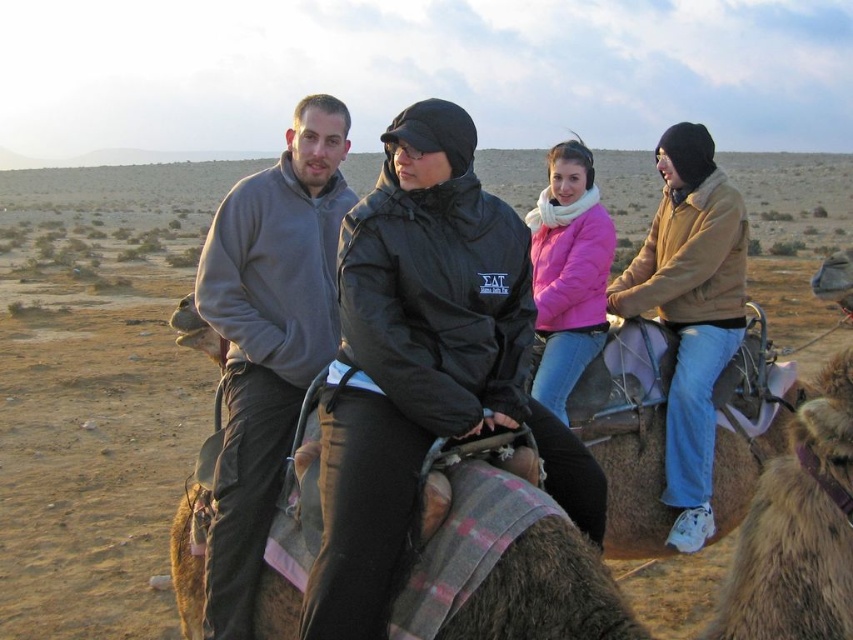
You are a photographer trying to capture a clear photo of the black matte jacket at center and the pink matte jacket at center. Which jacket should you focus on first to ensure it appears sharp in the photo?

The black matte jacket at center is below the pink matte jacket at center, so focusing on the black matte jacket at center first would ensure it is sharp since it is closer to the camera.

Based on the scene description and the objects provided, what does the point at coordinates (424, 362) indicate?

The point at coordinates (424, 362) marks the location of the black matte jacket at center.

You are navigating a drone over a desert scene where two points are marked. The first point is at coordinates point (384,422) and the second at point (311,99). According to the scene description, which point is closer to the camera?

Point (384,422) is in front of point (311,99), so it is closer to the camera.